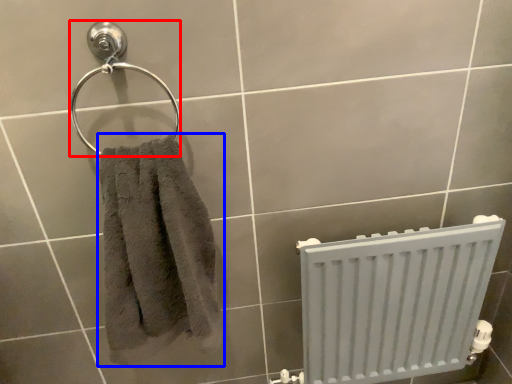
Question: Among these objects, which one is farthest to the camera, towel bar (highlighted by a red box) or towel (highlighted by a blue box)?

Choices:
 (A) towel bar
 (B) towel

Answer: (A)